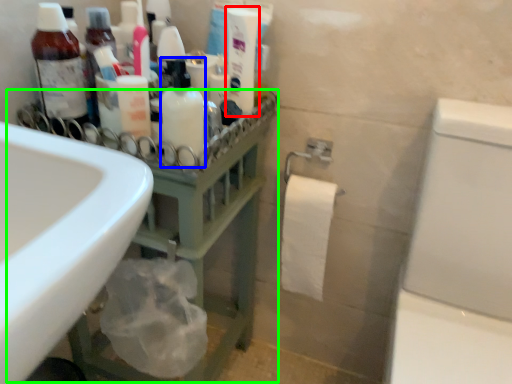
Question: Based on their relative distances, which object is farther from cleaning product (highlighted by a red box)? Choose from mouthwash (highlighted by a blue box) and balustrade (highlighted by a green box).

Choices:
 (A) mouthwash
 (B) balustrade

Answer: (B)